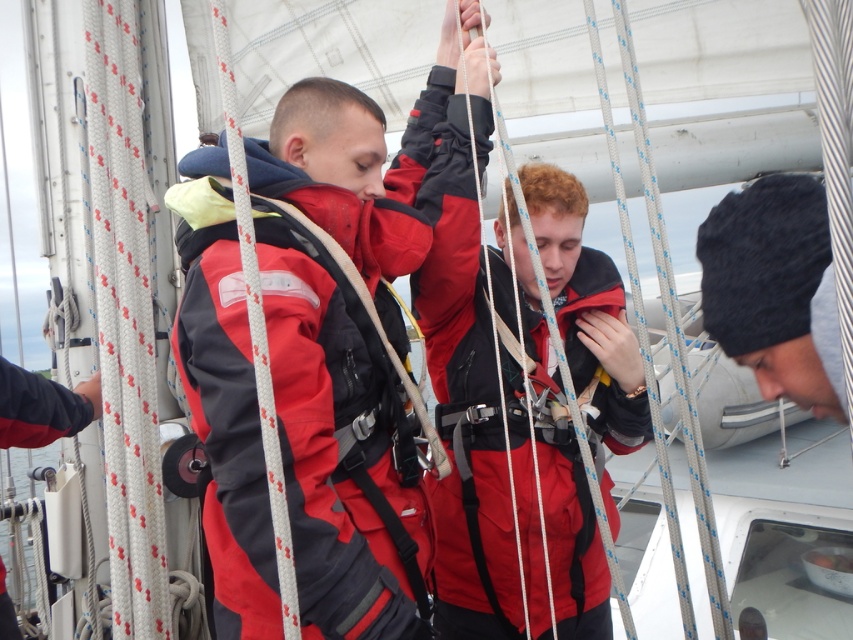
You are standing on the deck of a sailboat and want to grab a rope that is at point (531, 540). If your arm can reach up to 2 meters, can you reach it?

The point (531, 540) is 2.10 meters from the camera, so your arm can not reach it since it is beyond the 2 meters limit.

You are a photographer on a sailboat deck trying to capture a photo of both the red matte jacket at center and the black knit cap at lower right. Since you can only focus on one subject at a time, which object should you focus on first to ensure it appears sharp in the photo?

The red matte jacket at center is closer to the viewer than the black knit cap at lower right, so you should focus on the red matte jacket at center first to ensure it appears sharp in the photo.

You are a safety inspector on the deck of a sailboat. You need to ensure that all crew members are within a safe distance of each other for quick assistance. The minimum safe distance required is 28 inches. Are the red matte jacket at center and the black knit cap at lower right within the safe distance requirement?

The distance between the red matte jacket at center and the black knit cap at lower right is 27.87 inches, which is slightly less than the required 28 inches. Therefore, they are not within the safe distance requirement and need to adjust their positions to maintain safety protocols.